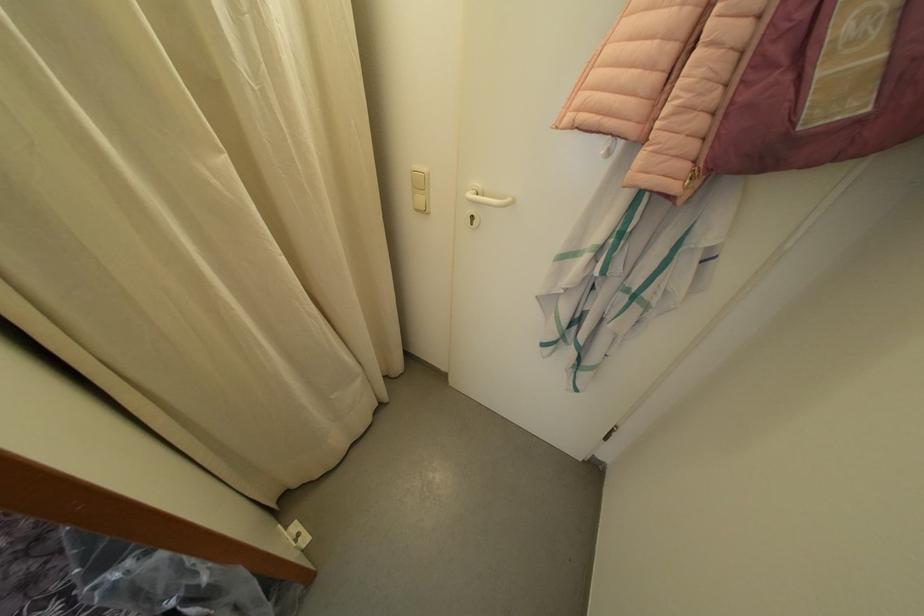
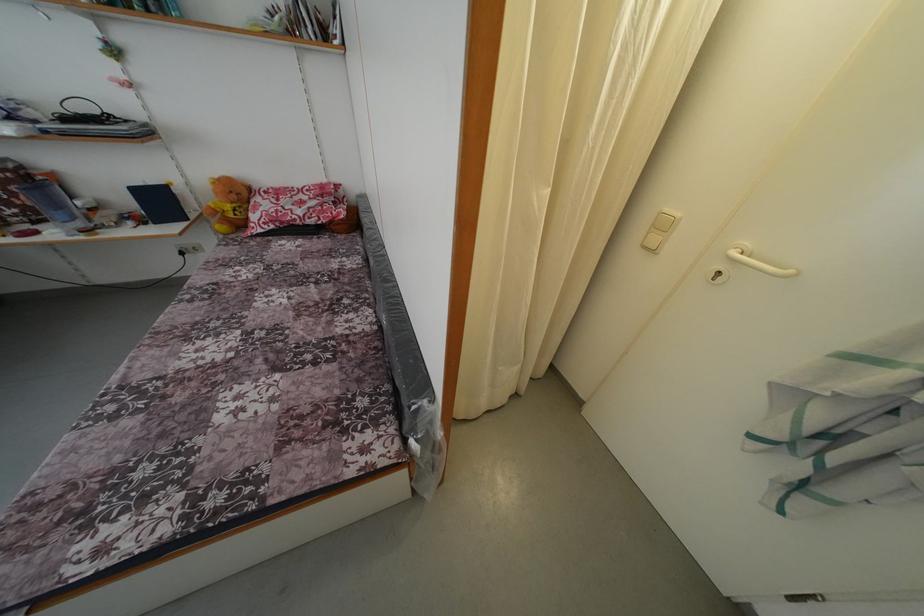
Question: Based on the continuous images, in which direction is the camera rotating? Reply with the corresponding letter.

Choices:
 (A) Left
 (B) Right
 (C) Up
 (D) Down

Answer: (A)